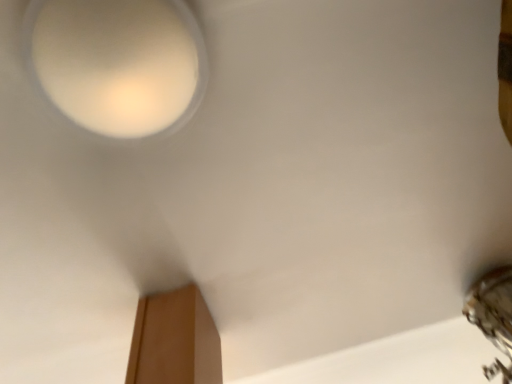
Locate an element on the screen. matte white lamp at upper left is located at coordinates (118, 63).

What do you see at coordinates (118, 63) in the screenshot? I see `matte white lamp at upper left` at bounding box center [118, 63].

Measure the distance between matte white lamp at upper left and camera.

A distance of 60.10 centimeters exists between matte white lamp at upper left and camera.

I want to click on matte white lamp at upper left, so click(x=118, y=63).